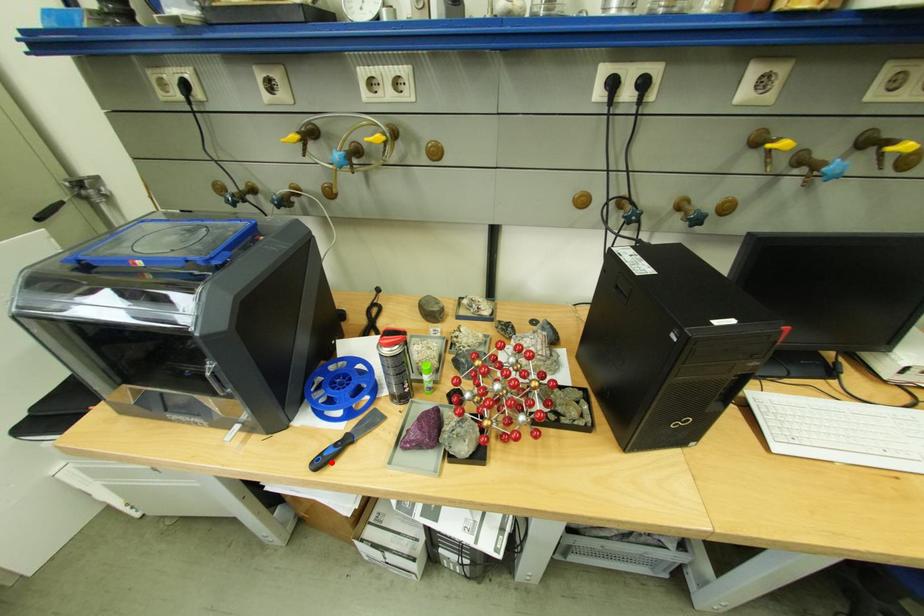
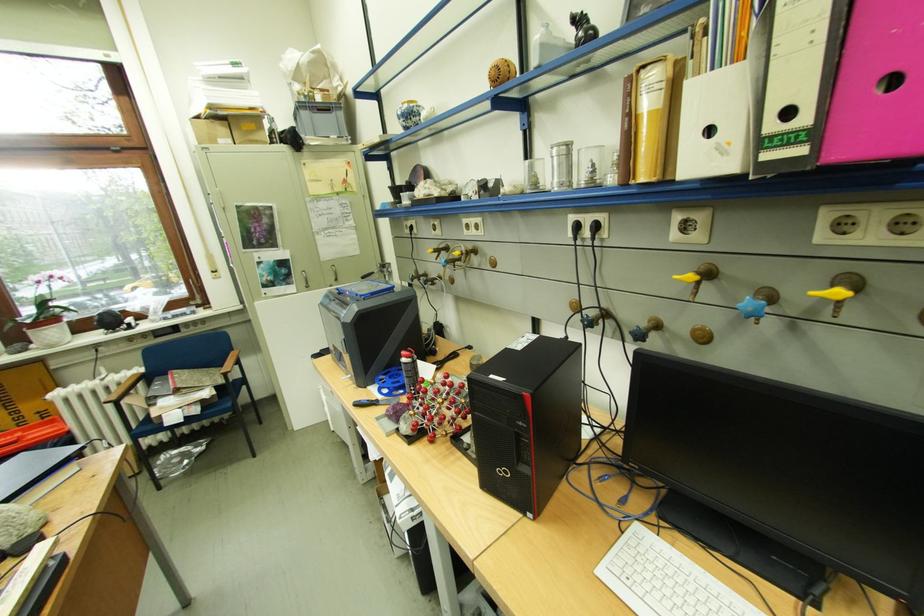
Where in the second image is the point corresponding to the highlighted location from the first image?

(369, 406)